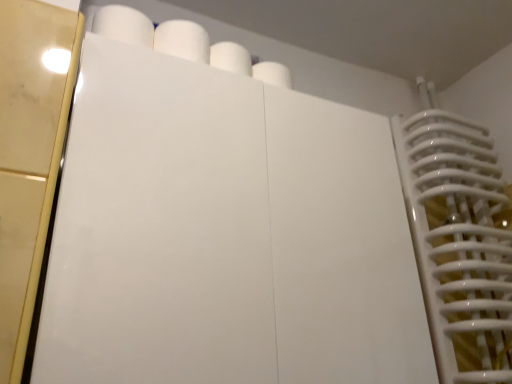
Question: Considering the relative sizes of white matte paper towel at upper center and white glossy door at upper center in the image provided, is white matte paper towel at upper center bigger than white glossy door at upper center?

Choices:
 (A) no
 (B) yes

Answer: (A)

Question: Can you confirm if white matte paper towel at upper center is positioned to the left of white glossy door at upper center?

Choices:
 (A) no
 (B) yes

Answer: (B)

Question: Does white matte paper towel at upper center have a lesser height compared to white glossy door at upper center?

Choices:
 (A) yes
 (B) no

Answer: (A)

Question: Considering the relative sizes of white matte paper towel at upper center and white glossy door at upper center in the image provided, is white matte paper towel at upper center taller than white glossy door at upper center?

Choices:
 (A) no
 (B) yes

Answer: (A)

Question: Are white matte paper towel at upper center and white glossy door at upper center beside each other?

Choices:
 (A) yes
 (B) no

Answer: (B)

Question: Is white glossy door at upper center surrounded by white matte paper towel at upper center?

Choices:
 (A) yes
 (B) no

Answer: (B)

Question: From a real-world perspective, is white glossy door at upper center beneath white matte paper towel at upper center?

Choices:
 (A) yes
 (B) no

Answer: (A)

Question: Would you say white glossy door at upper center is outside white matte paper towel at upper center?

Choices:
 (A) no
 (B) yes

Answer: (B)

Question: Does white glossy door at upper center turn towards white matte paper towel at upper center?

Choices:
 (A) no
 (B) yes

Answer: (A)

Question: Is white glossy door at upper center taller than white matte paper towel at upper center?

Choices:
 (A) yes
 (B) no

Answer: (A)

Question: From a real-world perspective, is white glossy door at upper center on top of white matte paper towel at upper center?

Choices:
 (A) yes
 (B) no

Answer: (B)

Question: Is white glossy door at upper center wider than white matte paper towel at upper center?

Choices:
 (A) yes
 (B) no

Answer: (A)

Question: In terms of width, does white glossy door at upper center look wider or thinner when compared to white matte paper towel at upper center?

Choices:
 (A) wide
 (B) thin

Answer: (A)